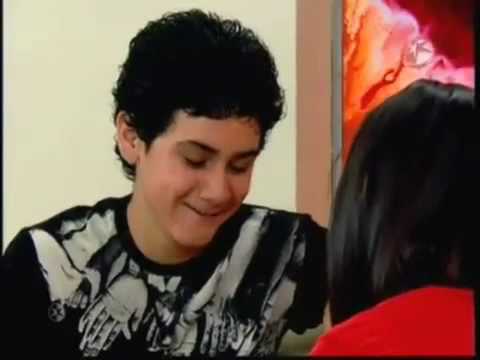
Find the location of `orange pink and red design on wall or a painting`. orange pink and red design on wall or a painting is located at coordinates tap(379, 71), tap(425, 29), tap(447, 56), tap(375, 34).